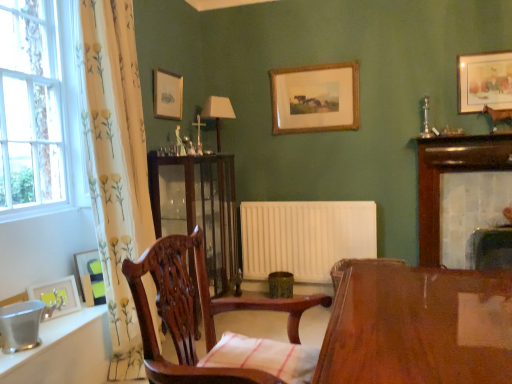
Question: Is mahogany wooden chair at center beside mahogany cabinet at center?

Choices:
 (A) no
 (B) yes

Answer: (A)

Question: Is mahogany wooden chair at center to the left of mahogany cabinet at center from the viewer's perspective?

Choices:
 (A) no
 (B) yes

Answer: (A)

Question: Can you confirm if mahogany wooden chair at center is wider than mahogany cabinet at center?

Choices:
 (A) no
 (B) yes

Answer: (B)

Question: Does mahogany wooden chair at center have a lesser width compared to mahogany cabinet at center?

Choices:
 (A) no
 (B) yes

Answer: (A)

Question: Can you confirm if mahogany wooden chair at center is smaller than mahogany cabinet at center?

Choices:
 (A) yes
 (B) no

Answer: (A)

Question: Does point (71, 302) appear closer or farther from the camera than point (185, 177)?

Choices:
 (A) farther
 (B) closer

Answer: (B)

Question: Do you think matte yellow picture frame at lower left, the first picture frame from the front, is within mahogany cabinet at center, or outside of it?

Choices:
 (A) inside
 (B) outside

Answer: (B)

Question: Is matte yellow picture frame at lower left, which appears as the 5th picture frame when viewed from the right, taller or shorter than mahogany cabinet at center?

Choices:
 (A) short
 (B) tall

Answer: (A)

Question: In terms of width, does matte yellow picture frame at lower left, which is the fifth picture frame in top-to-bottom order, look wider or thinner when compared to mahogany cabinet at center?

Choices:
 (A) thin
 (B) wide

Answer: (A)

Question: Visually, is wooden picture frame at upper right, the 4th picture frame positioned from the front, positioned to the left or to the right of white matte radiator at center?

Choices:
 (A) right
 (B) left

Answer: (A)

Question: From the image's perspective, relative to white matte radiator at center, is wooden picture frame at upper right, the 4th picture frame positioned from the front, above or below?

Choices:
 (A) below
 (B) above

Answer: (B)

Question: Is wooden picture frame at upper right, the 2th picture frame viewed from the back, inside the boundaries of white matte radiator at center, or outside?

Choices:
 (A) inside
 (B) outside

Answer: (B)

Question: Is wooden picture frame at upper right, which ranks as the 1th picture frame in top-to-bottom order, in front of or behind white matte radiator at center in the image?

Choices:
 (A) behind
 (B) front

Answer: (B)

Question: Looking at their shapes, would you say wooden picture frame at upper center, which is the 3th picture frame in left-to-right order, is wider or thinner than matte green picture frame at lower left, arranged as the fourth picture frame when viewed from the top?

Choices:
 (A) thin
 (B) wide

Answer: (A)

Question: Is point (159, 115) closer or farther from the camera than point (94, 266)?

Choices:
 (A) closer
 (B) farther

Answer: (B)